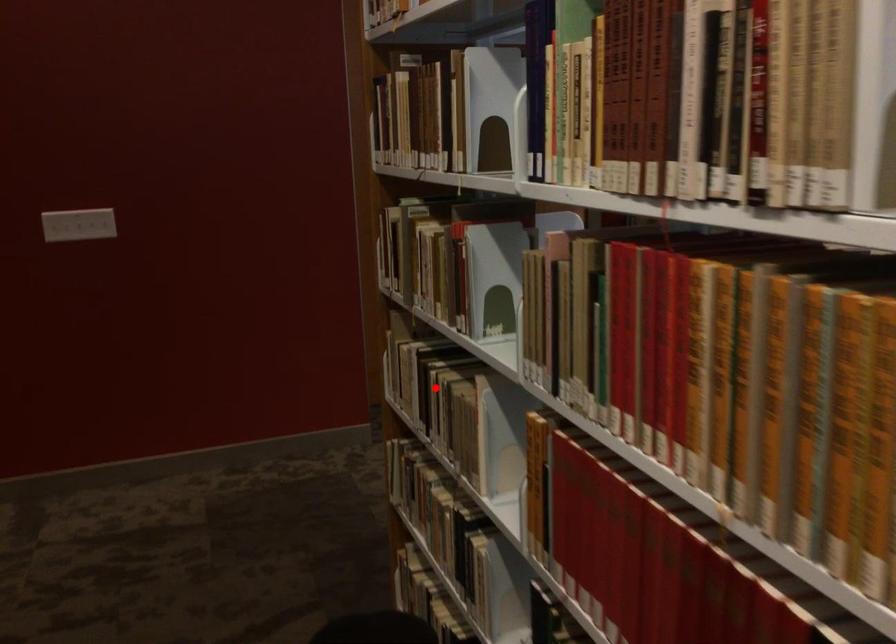
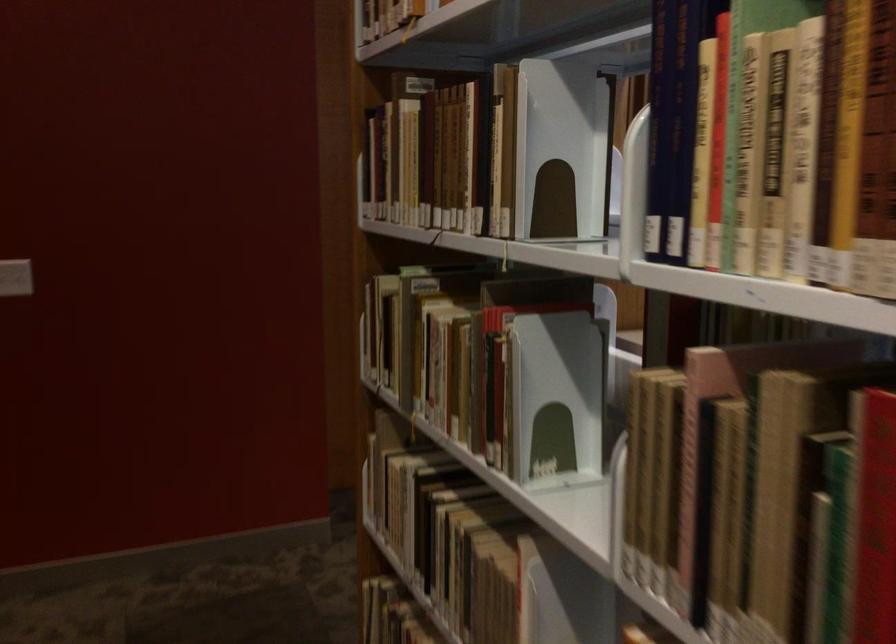
Question: I am providing you with two images of the same scene from different viewpoints. Given a red point in image1, look at the same physical point in image2. Is it:

Choices:
 (A) Closer to the viewpoint
 (B) Farther from the viewpoint

Answer: (A)